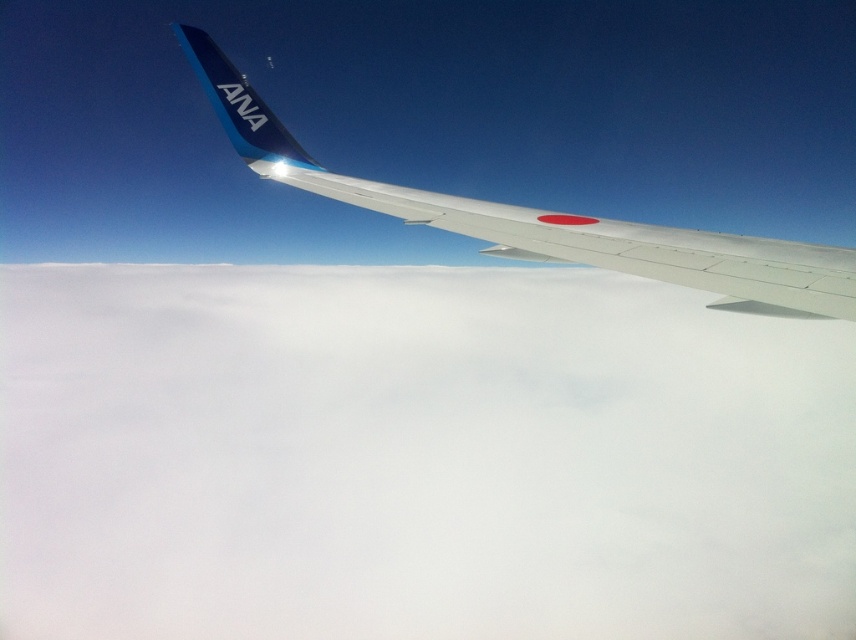
You are sitting in an airplane seat and looking out the window. You see a white fluffy cloud at upper center and a metallic silver wing at upper center. Which object appears larger in your view?

The white fluffy cloud at upper center appears larger than the metallic silver wing at upper center because it is bigger.

You are a passenger sitting in the airplane and looking out the window. You see a white fluffy cloud at upper center and a metallic silver wing at upper center. Which object is closer to the left edge of the window?

The white fluffy cloud at upper center is positioned on the left side of the metallic silver wing at upper center, so it is closer to the left edge of the window.

You are a passenger sitting in an airplane seat and looking out the window. You notice a point marked at coordinates (415, 458). What object is located at that point?

The point at coordinates (415, 458) corresponds to a white fluffy cloud at upper center.